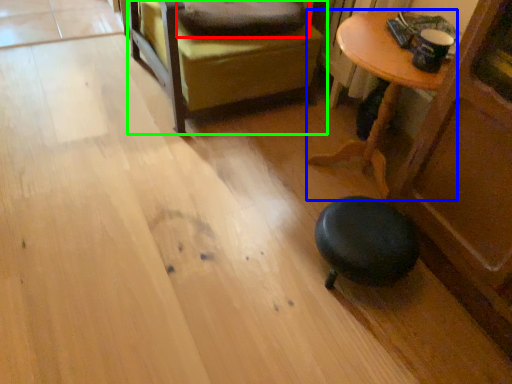
Question: Which is farther away from pillow (highlighted by a red box)? table (highlighted by a blue box) or furniture (highlighted by a green box)?

Choices:
 (A) table
 (B) furniture

Answer: (A)